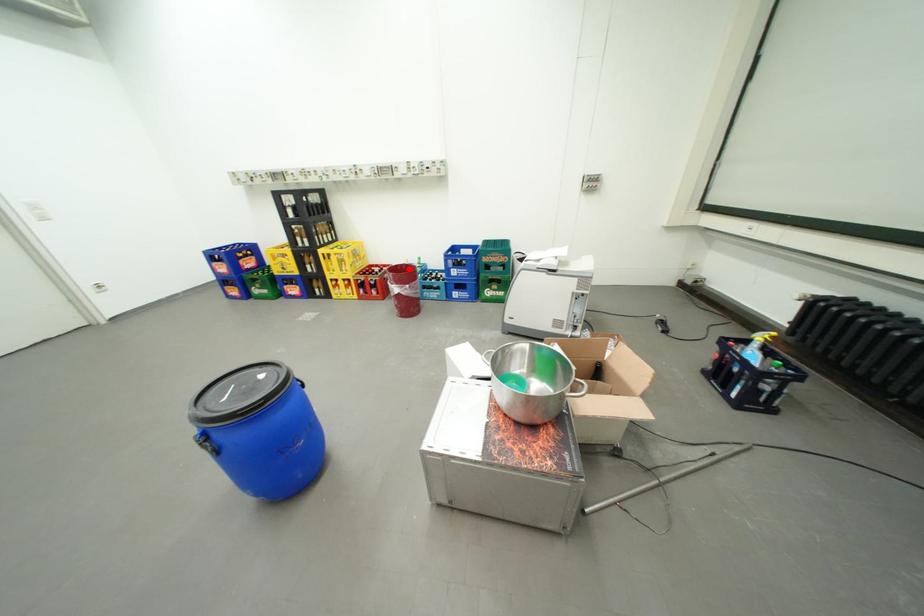
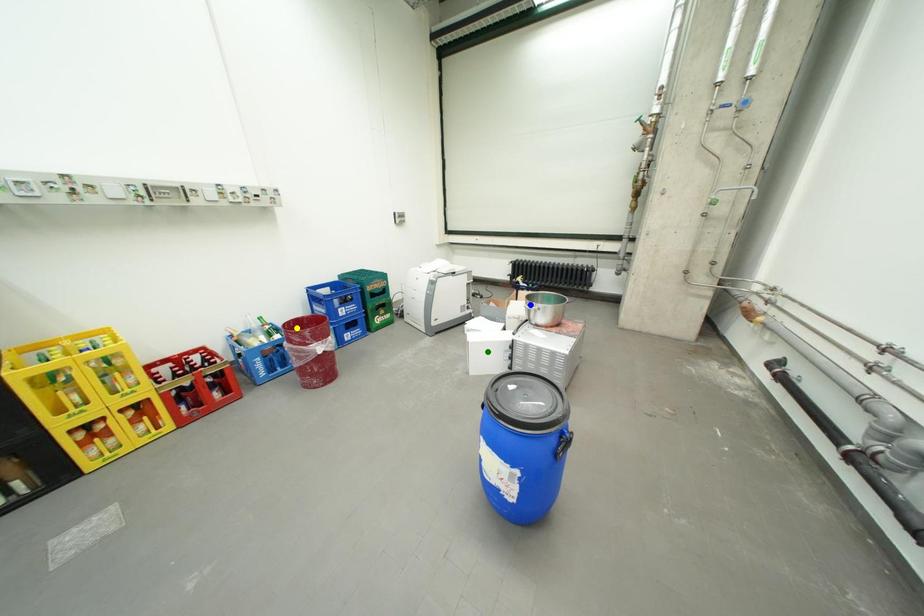
Question: I am providing you with two images of the same scene from different viewpoints. A red point is marked on the first image. You are given multiple points on the second image. Can you choose the point in image 2 that corresponds to the point in image 1?

Choices:
 (A) blue point
 (B) green point
 (C) yellow point

Answer: (C)